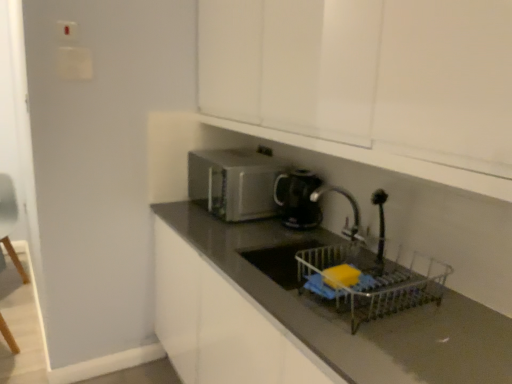
Where is `vacant space underneath metallic silver dish rack at lower center (from a real-world perspective)`? This screenshot has width=512, height=384. vacant space underneath metallic silver dish rack at lower center (from a real-world perspective) is located at coordinates (380, 304).